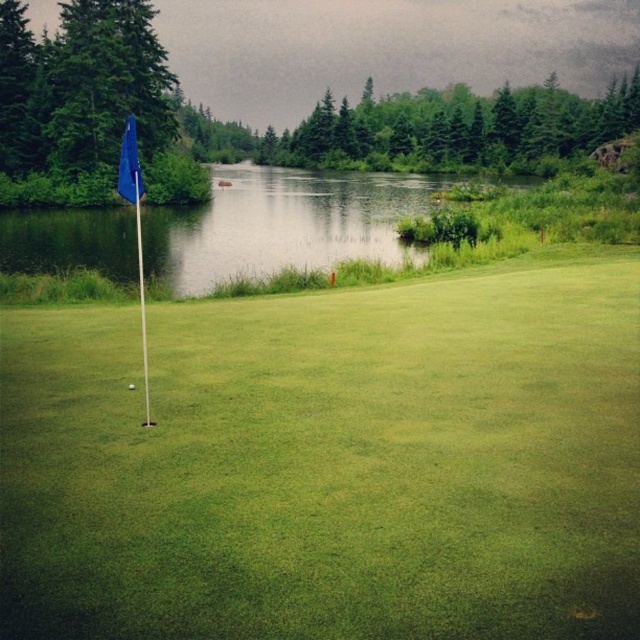
Question: Among these points, which one is farthest from the camera?

Choices:
 (A) (259, 589)
 (B) (358, 204)
 (C) (125, 182)
 (D) (129, 387)

Answer: (B)

Question: Where is green grassy golf hole at center located in relation to white matte golf ball at center in the image?

Choices:
 (A) below
 (B) above

Answer: (B)

Question: Which point is closer to the camera?

Choices:
 (A) blue fabric flag at left
 (B) white matte golf ball at center
 (C) green grassy golf hole at center
 (D) green grassy lake at left

Answer: (C)

Question: Does green grassy golf hole at center appear under blue fabric flag at left?

Choices:
 (A) no
 (B) yes

Answer: (B)

Question: Among these points, which one is farthest from the camera?

Choices:
 (A) (129, 388)
 (B) (129, 170)
 (C) (317, 262)
 (D) (16, 499)

Answer: (C)

Question: Does blue fabric flag at left lie in front of white matte golf ball at center?

Choices:
 (A) yes
 (B) no

Answer: (A)